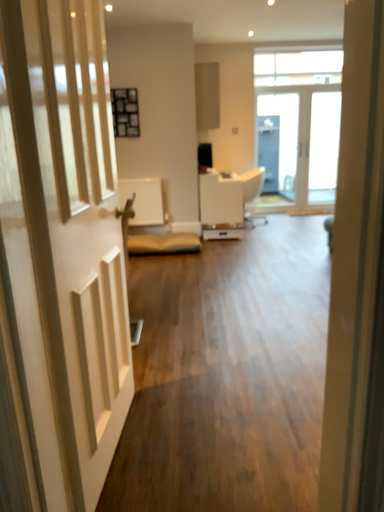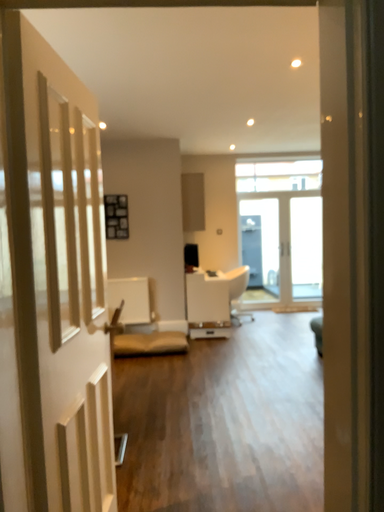
Question: Which way did the camera rotate in the video?

Choices:
 (A) rotated upward
 (B) rotated downward

Answer: (A)